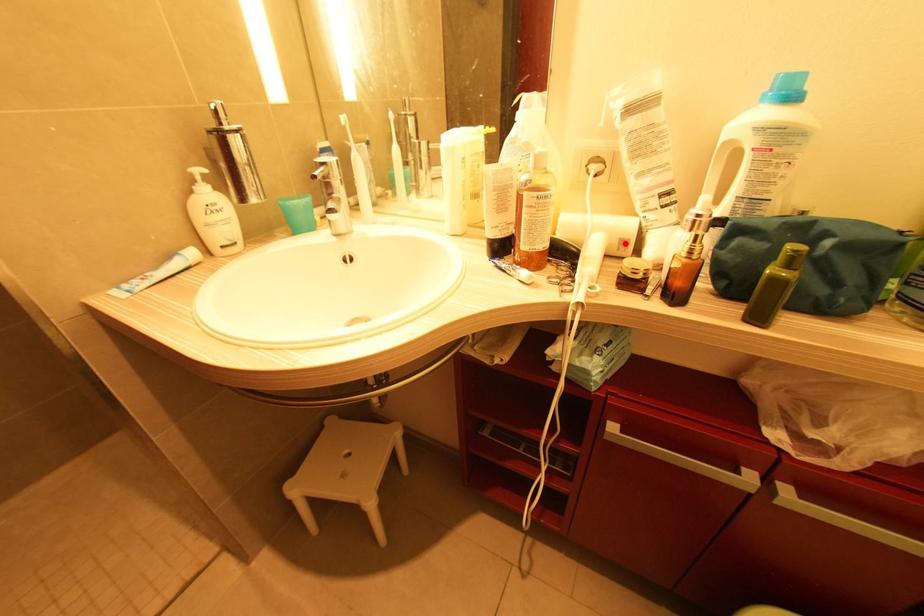
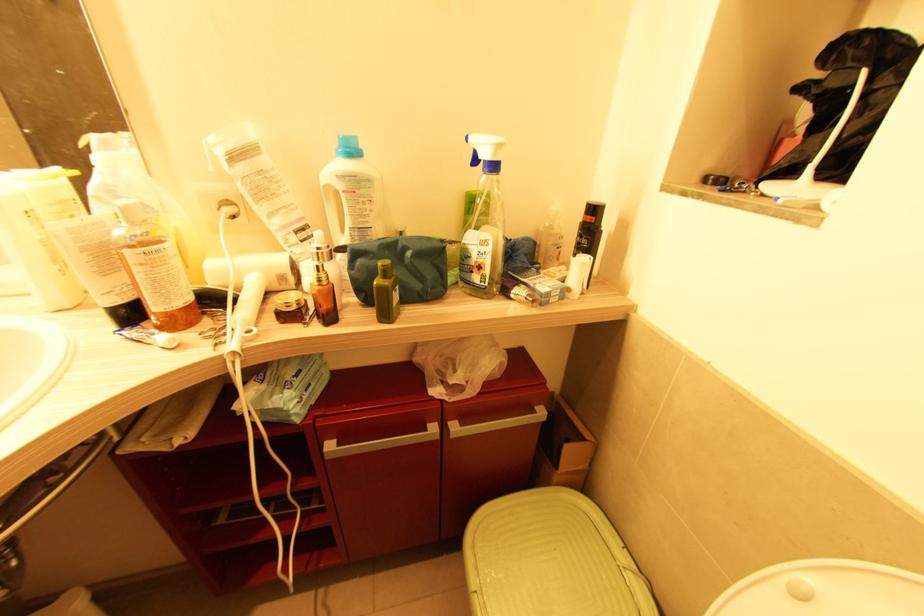
The point at the highlighted location is marked in the first image. Where is the corresponding point in the second image?

(284, 278)